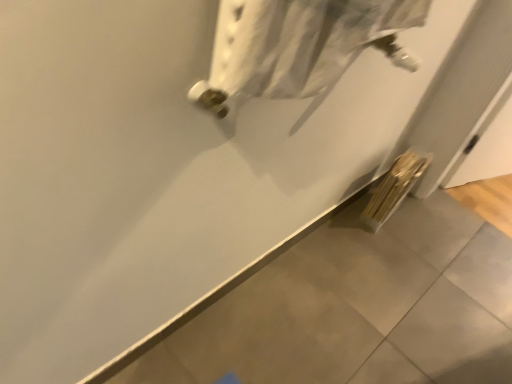
Question: Is white textured towel at upper center situated inside wooden sticks at lower right or outside?

Choices:
 (A) inside
 (B) outside

Answer: (B)

Question: Considering the positions of point (218, 56) and point (425, 160), is point (218, 56) closer or farther from the camera than point (425, 160)?

Choices:
 (A) farther
 (B) closer

Answer: (B)

Question: From the image's perspective, relative to wooden sticks at lower right, is white textured towel at upper center above or below?

Choices:
 (A) above
 (B) below

Answer: (A)

Question: From a real-world perspective, is wooden sticks at lower right above or below white textured towel at upper center?

Choices:
 (A) above
 (B) below

Answer: (B)

Question: Is wooden sticks at lower right situated inside white textured towel at upper center or outside?

Choices:
 (A) inside
 (B) outside

Answer: (B)

Question: In the image, is wooden sticks at lower right positioned in front of or behind white textured towel at upper center?

Choices:
 (A) behind
 (B) front

Answer: (A)

Question: Would you say wooden sticks at lower right is to the left or to the right of white textured towel at upper center in the picture?

Choices:
 (A) right
 (B) left

Answer: (A)